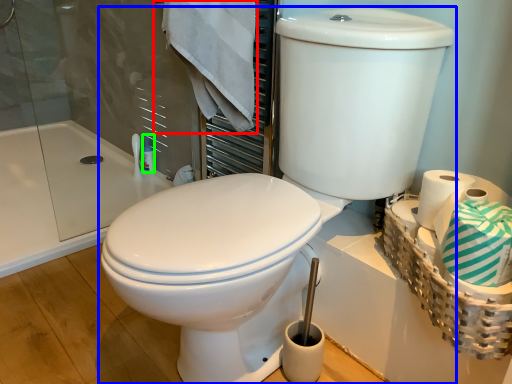
Question: Estimate the real-world distances between objects in this image. Which object is farther from bath towel (highlighted by a red box), toilet (highlighted by a blue box) or toiletry (highlighted by a green box)?

Choices:
 (A) toilet
 (B) toiletry

Answer: (B)